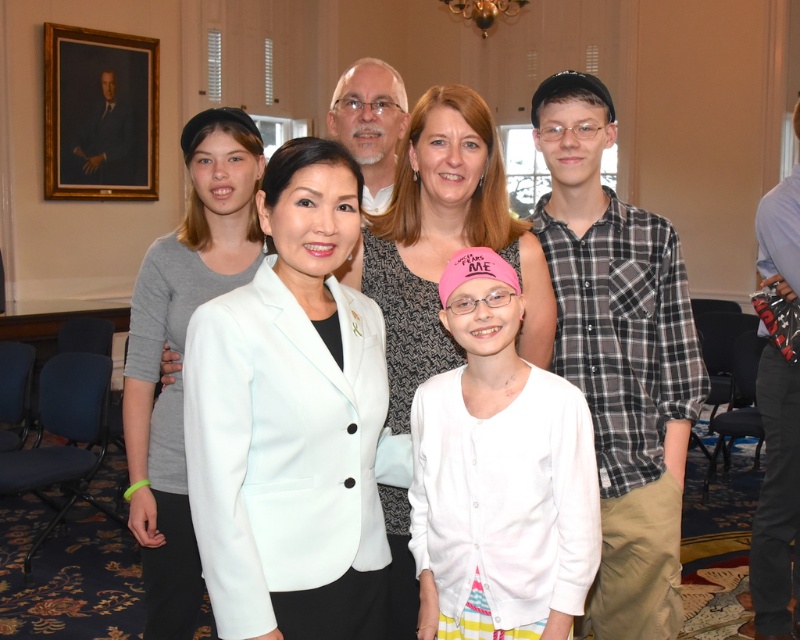
Can you confirm if white matte blazer at center is positioned to the left of plaid flannel shirt at right?

Indeed, white matte blazer at center is positioned on the left side of plaid flannel shirt at right.

Is point (196, 451) in front of point (590, 93)?

Yes, it is.

Locate an element on the screen. The image size is (800, 640). white matte blazer at center is located at coordinates (292, 419).

Is point (433, 589) in front of point (404, 413)?

Yes, it is in front of point (404, 413).

Locate an element on the screen. This screenshot has width=800, height=640. pink fabric cap at center is located at coordinates (500, 474).

Between point (558, 605) and point (446, 150), which one is positioned behind?

The point (446, 150) is behind.

Where is `pink fabric cap at center`? pink fabric cap at center is located at coordinates (500, 474).

Is white matte blazer at center wider than matte gray sweater at center?

No.

Locate an element on the screen. The height and width of the screenshot is (640, 800). white matte blazer at center is located at coordinates (292, 419).

The image size is (800, 640). Find the location of `white matte blazer at center`. white matte blazer at center is located at coordinates (292, 419).